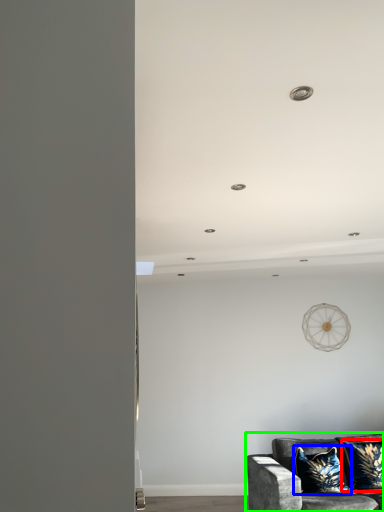
Question: Which object is positioned closest to pillow (highlighted by a red box)? Select from pillow (highlighted by a blue box) and studio couch (highlighted by a green box).

Choices:
 (A) pillow
 (B) studio couch

Answer: (A)